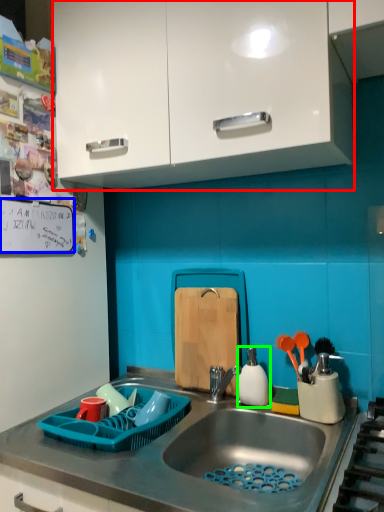
Question: Which object is the closest to the cabinetry (highlighted by a red box)? Choose among these: bulletin board (highlighted by a blue box) or appliance (highlighted by a green box).

Choices:
 (A) bulletin board
 (B) appliance

Answer: (A)